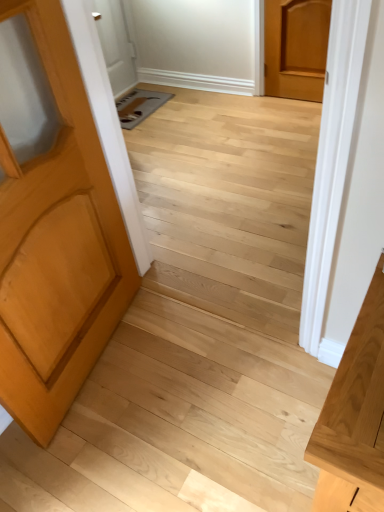
The width and height of the screenshot is (384, 512). Identify the location of light brown wood door at left, the 1th door positioned from the left. pyautogui.click(x=58, y=247).

From the picture: In order to face light brown wood door at upper right, the second door when ordered from left to right, should I rotate leftwards or rightwards?

A 13.781 degree turn to the right will do.

Identify the location of light brown wood door at left, positioned as the second door in back-to-front order. (58, 247).

How different are the orientations of light brown wood door at left, marked as the first door in a bottom-to-top arrangement, and light brown wood door at upper right, arranged as the first door when viewed from the right, in degrees?

→ light brown wood door at left, marked as the first door in a bottom-to-top arrangement, and light brown wood door at upper right, arranged as the first door when viewed from the right, are facing 102 degrees away from each other.

Is light brown wood door at left, the 1th door positioned from the left, thinner than light brown wood door at upper right, the second door when ordered from front to back?

In fact, light brown wood door at left, the 1th door positioned from the left, might be wider than light brown wood door at upper right, the second door when ordered from front to back.

Relative to light brown wood door at upper right, the second door when ordered from front to back, is light brown wood door at left, positioned as the second door in back-to-front order, in front or behind?

In the image, light brown wood door at left, positioned as the second door in back-to-front order, appears in front of light brown wood door at upper right, the second door when ordered from front to back.

The image size is (384, 512). What are the coordinates of `door above the light brown wood door at left, marked as the first door in a bottom-to-top arrangement (from the image's perspective)` in the screenshot? It's located at (296, 48).

Is light wood vanity at right taller or shorter than light brown wood door at left, marked as the first door in a bottom-to-top arrangement?

In the image, light wood vanity at right appears to be shorter than light brown wood door at left, marked as the first door in a bottom-to-top arrangement.

Considering the sizes of objects light wood vanity at right and light brown wood door at left, marked as the first door in a bottom-to-top arrangement, in the image provided, who is smaller, light wood vanity at right or light brown wood door at left, marked as the first door in a bottom-to-top arrangement,?

light wood vanity at right.

From a real-world perspective, is light wood vanity at right above or below light brown wood door at left, the 1th door positioned from the left?

light wood vanity at right is below light brown wood door at left, the 1th door positioned from the left.

Can you tell me how much light wood vanity at right and light brown wood door at left, the 1th door viewed from the front, differ in facing direction?

The facing directions of light wood vanity at right and light brown wood door at left, the 1th door viewed from the front, are 101 degrees apart.

Considering the sizes of objects light brown wood door at upper right, the second door when ordered from front to back, and light wood vanity at right in the image provided, who is smaller, light brown wood door at upper right, the second door when ordered from front to back, or light wood vanity at right?

Smaller between the two is light brown wood door at upper right, the second door when ordered from front to back.

Is point (283, 74) farther from viewer compared to point (333, 422)?

That is True.

Is light brown wood door at upper right, marked as the second door in a bottom-to-top arrangement, positioned with its back to light wood vanity at right?

No, light wood vanity at right is not at the back of light brown wood door at upper right, marked as the second door in a bottom-to-top arrangement.

Is light brown wood door at left, the 1th door positioned from the left, with light wood vanity at right?

No, light brown wood door at left, the 1th door positioned from the left, is not making contact with light wood vanity at right.

Would you say light brown wood door at left, marked as the first door in a bottom-to-top arrangement, is inside or outside light wood vanity at right?

The correct answer is: outside.

From a real-world perspective, who is located higher, light brown wood door at left, the 2th door positioned from the top, or light wood vanity at right?

light brown wood door at left, the 2th door positioned from the top, is physically above.

The width and height of the screenshot is (384, 512). Identify the location of vanity behind the light brown wood door at left, the 1th door positioned from the left. (354, 417).

Is light wood vanity at right inside or outside of light brown wood door at upper right, marked as the second door in a bottom-to-top arrangement?

light wood vanity at right is located beyond the bounds of light brown wood door at upper right, marked as the second door in a bottom-to-top arrangement.

Is light wood vanity at right taller than light brown wood door at upper right, the second door when ordered from left to right?

No.

How much distance is there between light wood vanity at right and light brown wood door at upper right, the second door when ordered from left to right?

A distance of 2.46 meters exists between light wood vanity at right and light brown wood door at upper right, the second door when ordered from left to right.

Which point is more distant from viewer, [371,378] or [327,40]?

Point [327,40]

Would you say light brown wood door at upper right, marked as the second door in a bottom-to-top arrangement, is outside light brown wood door at left, the 1th door viewed from the front?

Yes, light brown wood door at upper right, marked as the second door in a bottom-to-top arrangement, is outside of light brown wood door at left, the 1th door viewed from the front.

Is light brown wood door at upper right, the second door when ordered from left to right, to the left of light brown wood door at left, the 1th door viewed from the front, from the viewer's perspective?

Incorrect, light brown wood door at upper right, the second door when ordered from left to right, is not on the left side of light brown wood door at left, the 1th door viewed from the front.

Does light brown wood door at upper right, the second door when ordered from front to back, turn towards light brown wood door at left, marked as the first door in a bottom-to-top arrangement?

Yes.

Find the location of a particular element. door on the left of the light brown wood door at upper right, arranged as the first door when viewed from the right is located at coordinates (58, 247).

Locate an element on the screen. This screenshot has width=384, height=512. vanity below the light brown wood door at left, arranged as the 2th door when viewed from the right (from a real-world perspective) is located at coordinates (354, 417).

Estimate the real-world distances between objects in this image. Which object is further from light brown wood door at upper right, arranged as the first door when viewed from the right, light brown wood door at left, arranged as the 2th door when viewed from the right, or light wood vanity at right?

light wood vanity at right is positioned further to the anchor light brown wood door at upper right, arranged as the first door when viewed from the right.

When comparing their distances from light brown wood door at left, the 1th door viewed from the front, does light brown wood door at upper right, acting as the first door starting from the back, or light wood vanity at right seem further?

The object further to light brown wood door at left, the 1th door viewed from the front, is light brown wood door at upper right, acting as the first door starting from the back.

Which object lies nearer to the anchor point light wood vanity at right, light brown wood door at left, the 1th door viewed from the front, or light brown wood door at upper right, the second door when ordered from front to back?

The object closer to light wood vanity at right is light brown wood door at left, the 1th door viewed from the front.

Based on their spatial positions, is light wood vanity at right or light brown wood door at left, positioned as the second door in back-to-front order, closer to light brown wood door at upper right, marked as the second door in a bottom-to-top arrangement?

Based on the image, light brown wood door at left, positioned as the second door in back-to-front order, appears to be nearer to light brown wood door at upper right, marked as the second door in a bottom-to-top arrangement.

From the image, which object appears to be farther from light wood vanity at right, light brown wood door at upper right, acting as the first door starting from the back, or light brown wood door at left, positioned as the second door in back-to-front order?

light brown wood door at upper right, acting as the first door starting from the back, lies further to light wood vanity at right than the other object.

Based on their spatial positions, is light wood vanity at right or light brown wood door at upper right, arranged as the first door when viewed from the right, closer to light brown wood door at left, positioned as the second door in back-to-front order?

light wood vanity at right lies closer to light brown wood door at left, positioned as the second door in back-to-front order, than the other object.

Where is `vanity located between light brown wood door at left, marked as the first door in a bottom-to-top arrangement, and light brown wood door at upper right, acting as the first door starting from the back, in the depth direction`? The height and width of the screenshot is (512, 384). vanity located between light brown wood door at left, marked as the first door in a bottom-to-top arrangement, and light brown wood door at upper right, acting as the first door starting from the back, in the depth direction is located at coordinates (354, 417).